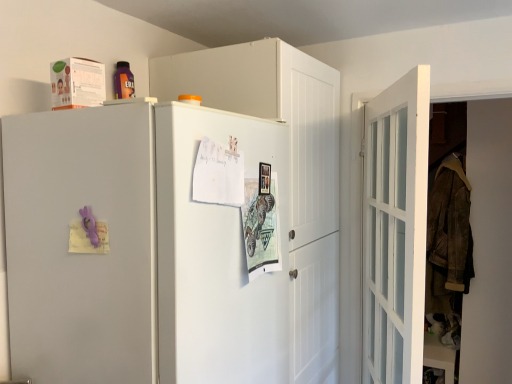
What do you see at coordinates (395, 229) in the screenshot? The height and width of the screenshot is (384, 512). I see `white glossy door at right` at bounding box center [395, 229].

Where is `white glossy door at right`? The image size is (512, 384). white glossy door at right is located at coordinates (395, 229).

Considering the positions of objects white matte refrigerator at upper left and white matte cabinet at upper center in the image provided, who is in front, white matte refrigerator at upper left or white matte cabinet at upper center?

white matte refrigerator at upper left is in front.

Locate an element on the screen. The image size is (512, 384). cabinetry that appears above the white matte refrigerator at upper left (from a real-world perspective) is located at coordinates (288, 170).

Is white matte refrigerator at upper left to the left of white matte cabinet at upper center from the viewer's perspective?

Yes.

Between point (51, 261) and point (166, 66), which one is positioned behind?

Positioned behind is point (166, 66).

Do you think white matte refrigerator at upper left is within white glossy door at right, or outside of it?

white matte refrigerator at upper left is not enclosed by white glossy door at right.

From the image's perspective, which one is positioned lower, white matte refrigerator at upper left or white glossy door at right?

From the image's view, white matte refrigerator at upper left is below.

Is white matte refrigerator at upper left oriented away from white glossy door at right?

No, white matte refrigerator at upper left is not facing the opposite direction of white glossy door at right.

From a real-world perspective, is white matte refrigerator at upper left physically located above or below white glossy door at right?

white matte refrigerator at upper left is situated lower than white glossy door at right in the real world.

Who is taller, white matte cabinet at upper center or white glossy door at right?

white matte cabinet at upper center is taller.

Which is in front, white matte cabinet at upper center or white glossy door at right?

white glossy door at right is in front.

The height and width of the screenshot is (384, 512). I want to click on door in front of the white matte cabinet at upper center, so click(x=395, y=229).

Is white matte cabinet at upper center spatially inside white glossy door at right, or outside of it?

white matte cabinet at upper center cannot be found inside white glossy door at right.

What are the coordinates of `cabinetry on the left of white glossy door at right` in the screenshot? It's located at (288, 170).

Does white glossy door at right lie behind white matte cabinet at upper center?

No, white glossy door at right is closer to the viewer.

Does white glossy door at right have a greater height compared to white matte cabinet at upper center?

In fact, white glossy door at right may be shorter than white matte cabinet at upper center.

Considering the points (389, 114) and (336, 73), which point is behind, point (389, 114) or point (336, 73)?

Point (336, 73)

I want to click on refrigerator located on the left of white glossy door at right, so click(x=142, y=247).

Which is more to the left, white glossy door at right or white matte refrigerator at upper left?

white matte refrigerator at upper left.

From a real-world perspective, who is located lower, white glossy door at right or white matte refrigerator at upper left?

white matte refrigerator at upper left is physically lower.

Can you confirm if white glossy door at right is wider than white matte refrigerator at upper left?

In fact, white glossy door at right might be narrower than white matte refrigerator at upper left.

Can you see white matte cabinet at upper center touching white matte refrigerator at upper left?

white matte cabinet at upper center and white matte refrigerator at upper left are clearly separated.

From a real-world perspective, is white matte cabinet at upper center over white matte refrigerator at upper left?

Yes, from a real-world perspective, white matte cabinet at upper center is over white matte refrigerator at upper left

This screenshot has height=384, width=512. What are the coordinates of `cabinetry on the right of the white matte refrigerator at upper left` in the screenshot? It's located at (288, 170).

Find the location of `refrigerator in front of the white matte cabinet at upper center`. refrigerator in front of the white matte cabinet at upper center is located at coordinates (142, 247).

The image size is (512, 384). What are the coordinates of `door positioned vertically above the white matte refrigerator at upper left (from a real-world perspective)` in the screenshot? It's located at (395, 229).

Estimate the real-world distances between objects in this image. Which object is further from white matte cabinet at upper center, white matte refrigerator at upper left or white glossy door at right?

white glossy door at right is further to white matte cabinet at upper center.

From the image, which object appears to be nearer to white glossy door at right, white matte refrigerator at upper left or white matte cabinet at upper center?

The object closer to white glossy door at right is white matte cabinet at upper center.

Which object lies further to the anchor point white matte refrigerator at upper left, white glossy door at right or white matte cabinet at upper center?

white glossy door at right is further to white matte refrigerator at upper left.

Which object lies further to the anchor point white matte cabinet at upper center, white glossy door at right or white matte refrigerator at upper left?

white glossy door at right.

Which object lies nearer to the anchor point white matte refrigerator at upper left, white matte cabinet at upper center or white glossy door at right?

white matte cabinet at upper center is positioned closer to the anchor white matte refrigerator at upper left.

Based on their spatial positions, is white matte cabinet at upper center or white matte refrigerator at upper left closer to white glossy door at right?

white matte cabinet at upper center is positioned closer to the anchor white glossy door at right.

Identify the location of cabinetry situated between white matte refrigerator at upper left and white glossy door at right from left to right. (288, 170).